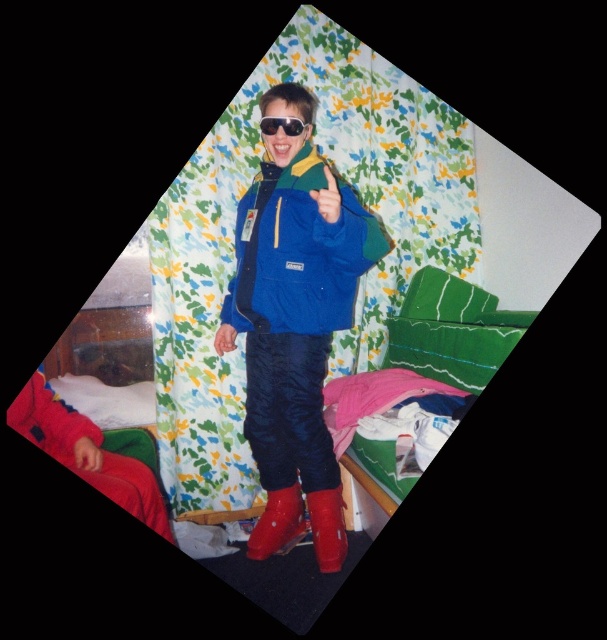
Is matte blue jacket at center wider than rubber boots at lower center?

Correct, the width of matte blue jacket at center exceeds that of rubber boots at lower center.

Which of these two, matte blue jacket at center or rubber boots at lower center, stands taller?

matte blue jacket at center

Who is more distant from viewer, (270,438) or (334,556)?

The point (270,438) is behind.

At what (x,y) coordinates should I click in order to perform the action: click on matte blue jacket at center. Please return your answer as a coordinate pair (x, y). This screenshot has height=640, width=607. Looking at the image, I should click on (293, 310).

Between point (324, 356) and point (279, 118), which one is positioned in front?

Positioned in front is point (279, 118).

Between matte blue jacket at center and black reflective sunglasses at center, which one appears on the left side from the viewer's perspective?

black reflective sunglasses at center

Image resolution: width=607 pixels, height=640 pixels. Describe the element at coordinates (293, 310) in the screenshot. I see `matte blue jacket at center` at that location.

Where is `matte blue jacket at center`? matte blue jacket at center is located at coordinates (293, 310).

Does matte blue jacket at center lie in front of blue matte jacket at center?

That is True.

This screenshot has height=640, width=607. In order to click on matte blue jacket at center in this screenshot , I will do [x=293, y=310].